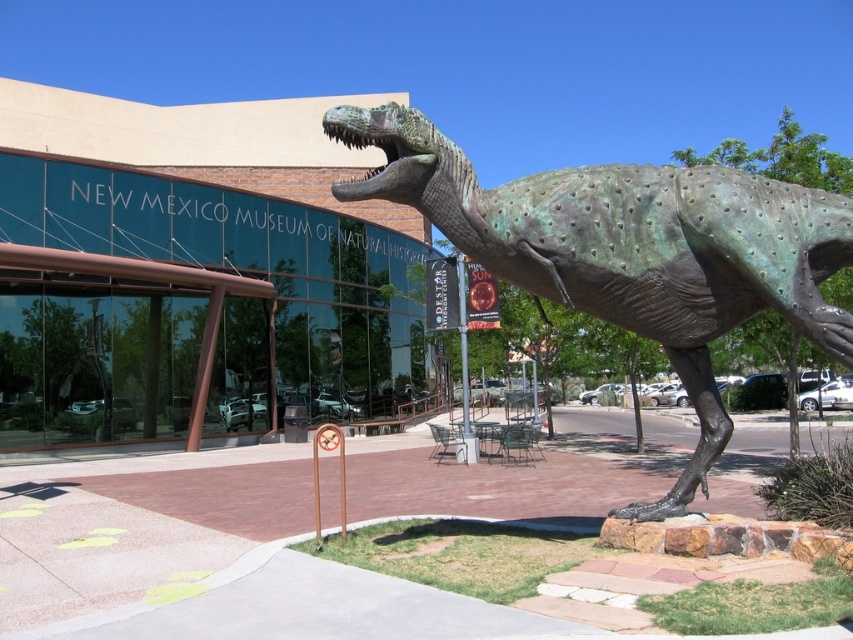
Question: Which object is farther from the camera taking this photo?

Choices:
 (A) green patina dinosaur at center
 (B) green glass building at center

Answer: (B)

Question: Does green glass building at center have a lesser width compared to green patina dinosaur at center?

Choices:
 (A) yes
 (B) no

Answer: (B)

Question: Does green glass building at center appear on the left side of green patina dinosaur at center?

Choices:
 (A) no
 (B) yes

Answer: (B)

Question: Which object is farther from the camera taking this photo?

Choices:
 (A) green patina dinosaur at center
 (B) green glass building at center

Answer: (B)

Question: Among these points, which one is farthest from the camera?

Choices:
 (A) (310, 256)
 (B) (775, 218)

Answer: (A)

Question: Is green glass building at center below green patina dinosaur at center?

Choices:
 (A) yes
 (B) no

Answer: (B)